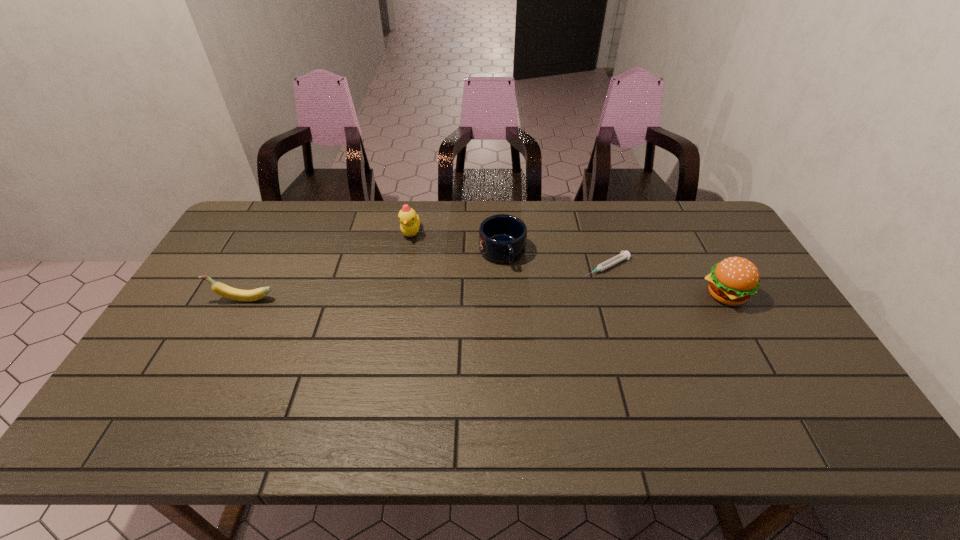
Find the location of a particular element. free space on the desktop that is between the banana and the hamburger and is positioned with the handle on the side of the mug is located at coordinates (520, 296).

Where is `vacant spot on the desktop that is between the leftmost object and the hamburger and is positioned on the front-facing side of the duckling`? vacant spot on the desktop that is between the leftmost object and the hamburger and is positioned on the front-facing side of the duckling is located at coordinates (429, 298).

Identify the location of free space on the desktop that is between the leftmost object and the hamburger and is positioned at the needle end of the shortest object. pyautogui.click(x=549, y=296).